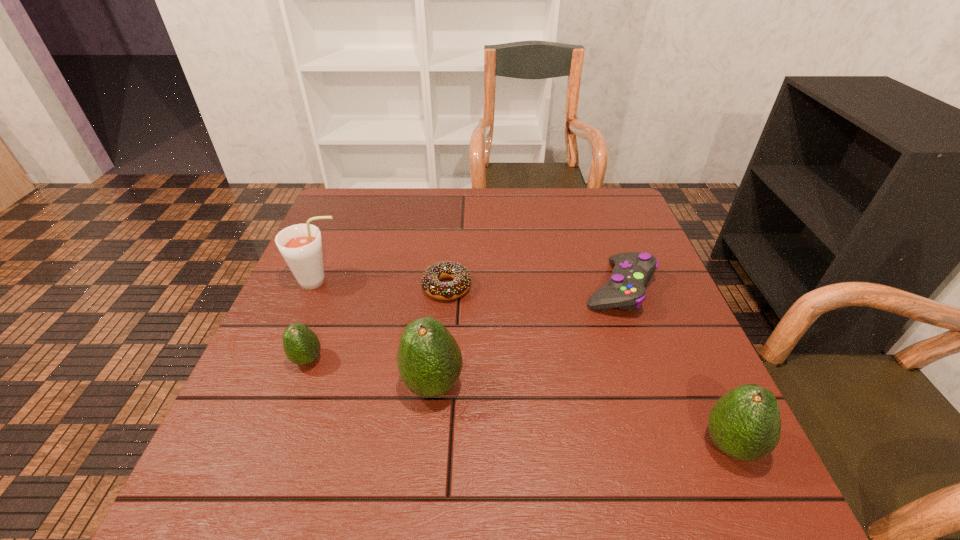
The height and width of the screenshot is (540, 960). I want to click on free space located 0.170m on the back of the fourth shortest object, so click(685, 347).

This screenshot has width=960, height=540. What are the coordinates of `free spot located on the front of the control` in the screenshot? It's located at (665, 420).

You are a GUI agent. You are given a task and a screenshot of the screen. Output one action in this format:
    pyautogui.click(x=<x>, y=<y>)
    Task: Click on the free space located 0.100m on the back of the doughnut
    This screenshot has width=960, height=540.
    Given the screenshot: What is the action you would take?
    pyautogui.click(x=450, y=247)

In order to click on free space located on the drink side of the root beer in this screenshot , I will do `click(402, 281)`.

The width and height of the screenshot is (960, 540). What are the coordinates of `avocado present at the left edge` in the screenshot? It's located at (301, 345).

This screenshot has width=960, height=540. What are the coordinates of `root beer that is positioned at the left edge` in the screenshot? It's located at (300, 245).

Image resolution: width=960 pixels, height=540 pixels. In order to click on avocado that is at the right edge in this screenshot , I will do click(745, 424).

Find the location of a particular element. This screenshot has width=960, height=540. control that is positioned at the right edge is located at coordinates (625, 289).

At what (x,y) coordinates should I click in order to perform the action: click on object present at the near right corner. Please return your answer as a coordinate pair (x, y). This screenshot has width=960, height=540. Looking at the image, I should click on (745, 424).

Image resolution: width=960 pixels, height=540 pixels. Identify the location of blank area at the far edge. (510, 227).